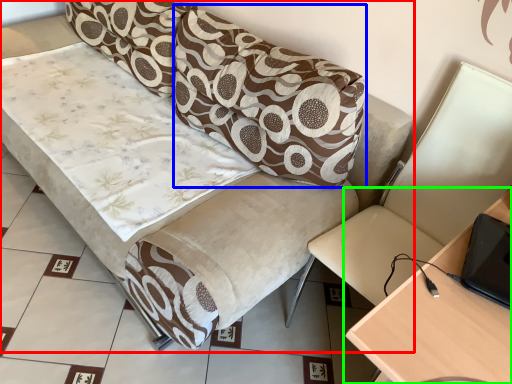
Question: Estimate the real-world distances between objects in this image. Which object is farther from studio couch (highlighted by a red box), pillow (highlighted by a blue box) or table (highlighted by a green box)?

Choices:
 (A) pillow
 (B) table

Answer: (B)